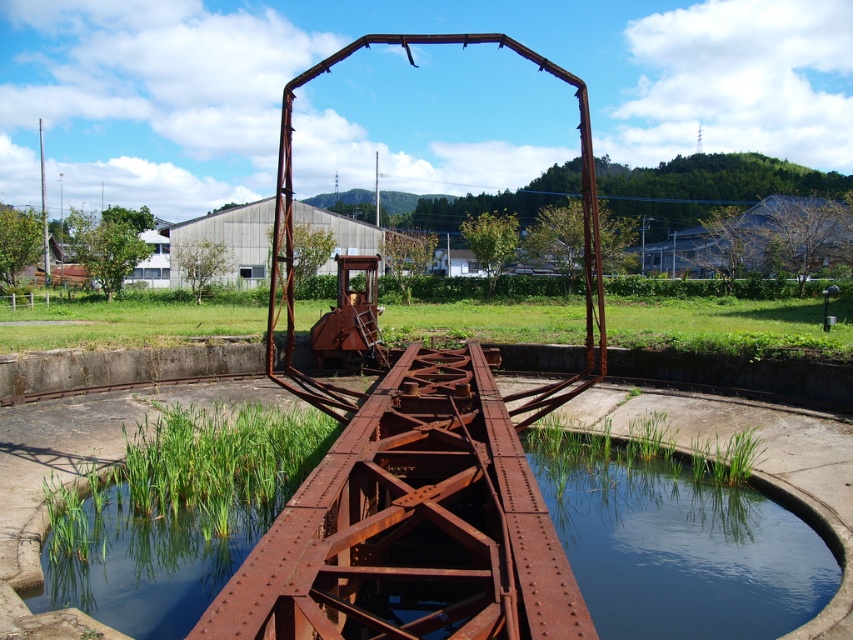
You are standing at the base of the industrial structure and want to reach the point marked at coordinates point (322,492). Given that the structure is 5 meters wide, can you walk directly to that point without crossing the water?

The point (322,492) is 3.74 meters from the viewer. Since the structure is 5 meters wide, you can walk directly to the point without crossing the water as the distance is within the structure width.

You are standing at the point marked as point (410, 525) on the rusty metal rail at center. Which direction should you walk to reach the water?

The point (410, 525) is on the rusty metal rail at center. Since the water is beneath the structure, you should walk downward or toward the lower part of the structure to reach the water.

Looking at this image, you are a maintenance worker inspecting the industrial area. You notice the rusty metal pond at center and the clear water at bottom center. Which one is positioned higher in the scene?

The rusty metal pond at center is above clear water at bottom center, so it is positioned higher in the scene.